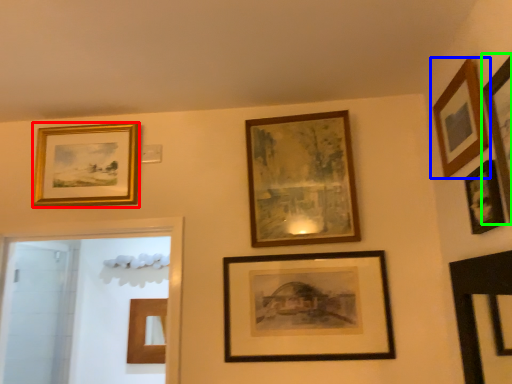
Question: Based on their relative distances, which object is nearer to picture frame (highlighted by a red box)? Choose from picture frame (highlighted by a blue box) and picture frame (highlighted by a green box).

Choices:
 (A) picture frame
 (B) picture frame

Answer: (A)